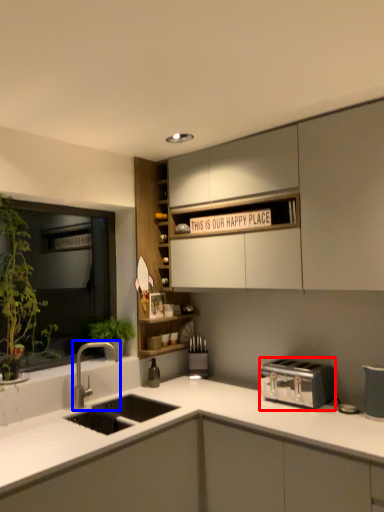
Question: Which object is closer to the camera taking this photo, toaster (highlighted by a red box) or tap (highlighted by a blue box)?

Choices:
 (A) toaster
 (B) tap

Answer: (A)